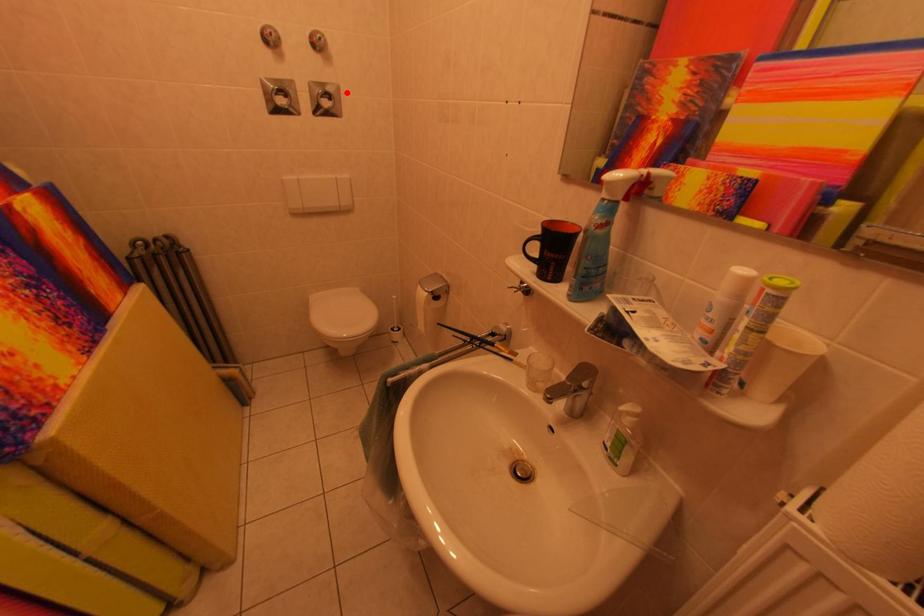
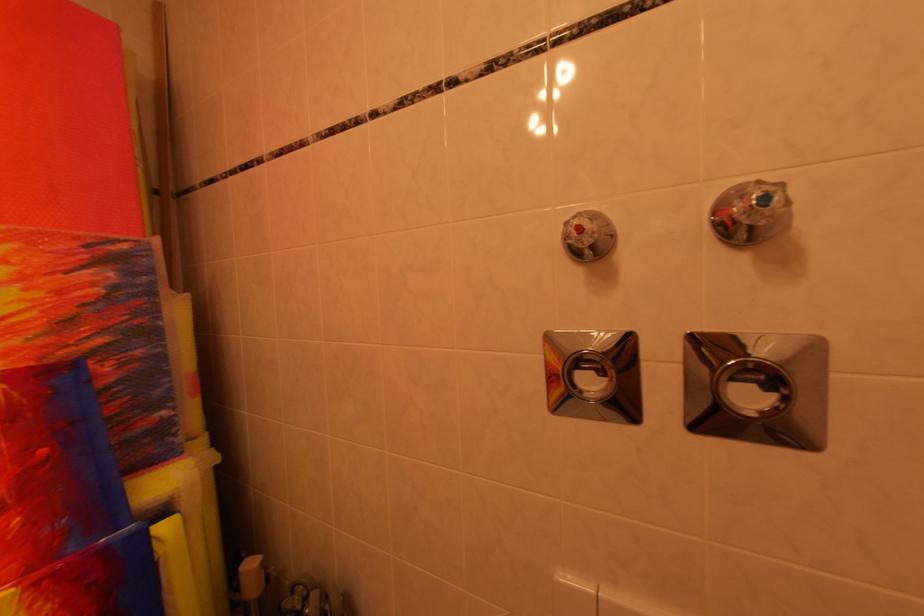
The point at the highlighted location is marked in the first image. Where is the corresponding point in the second image?

(824, 351)